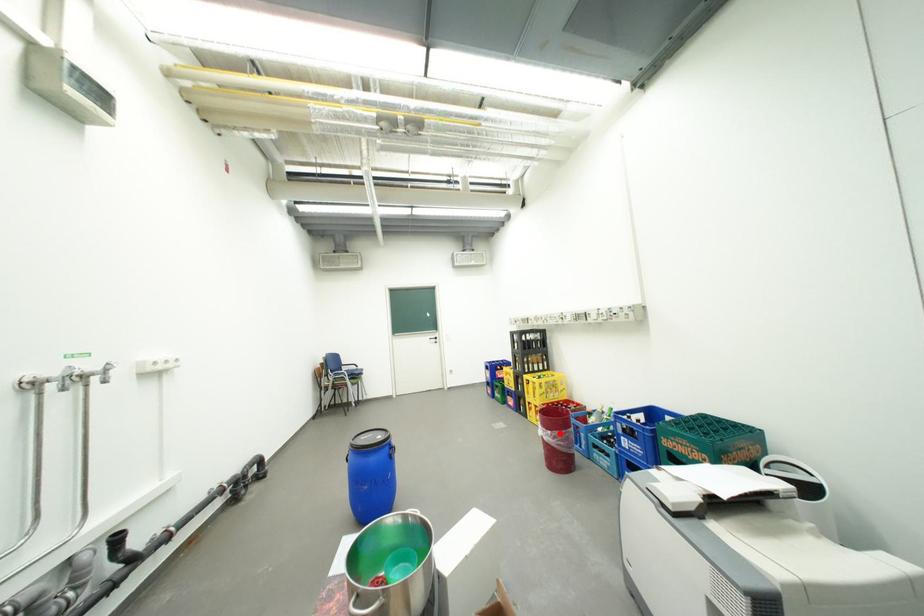
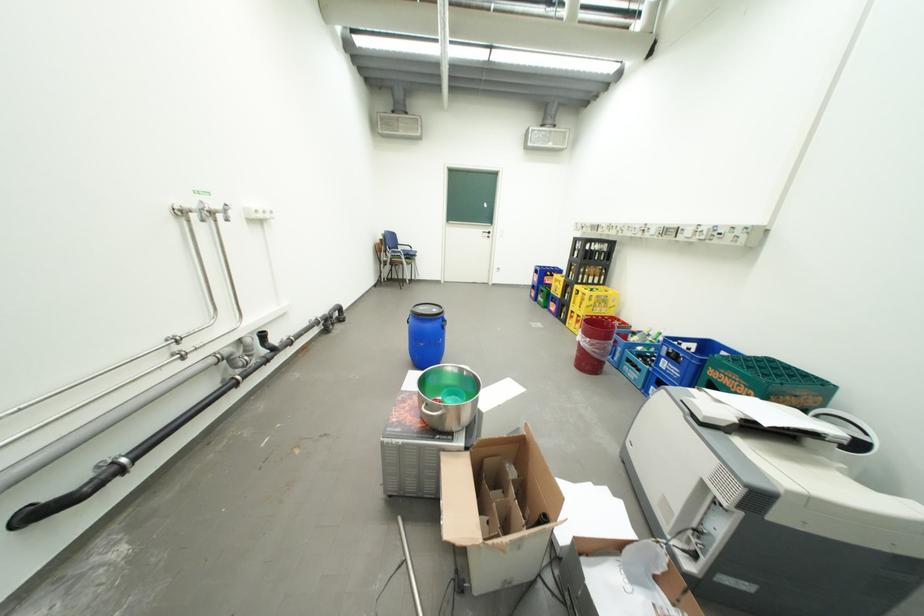
In the second image, find the point that corresponds to the highlighted location in the first image.

(599, 341)